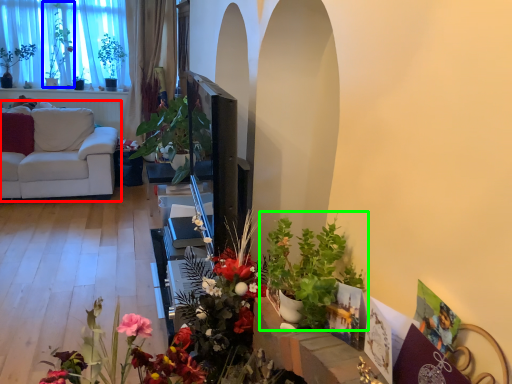
Question: Which is nearer to the studio couch (highlighted by a red box)? bouquet (highlighted by a blue box) or houseplant (highlighted by a green box).

Choices:
 (A) bouquet
 (B) houseplant

Answer: (A)